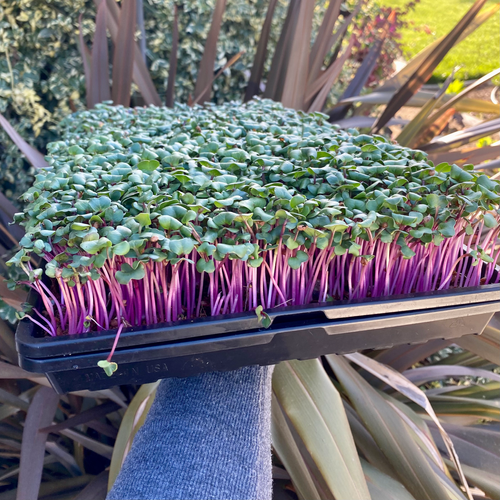
Image resolution: width=500 pixels, height=500 pixels. Find the location of `black tray`. black tray is located at coordinates [x=290, y=343], [x=249, y=322].